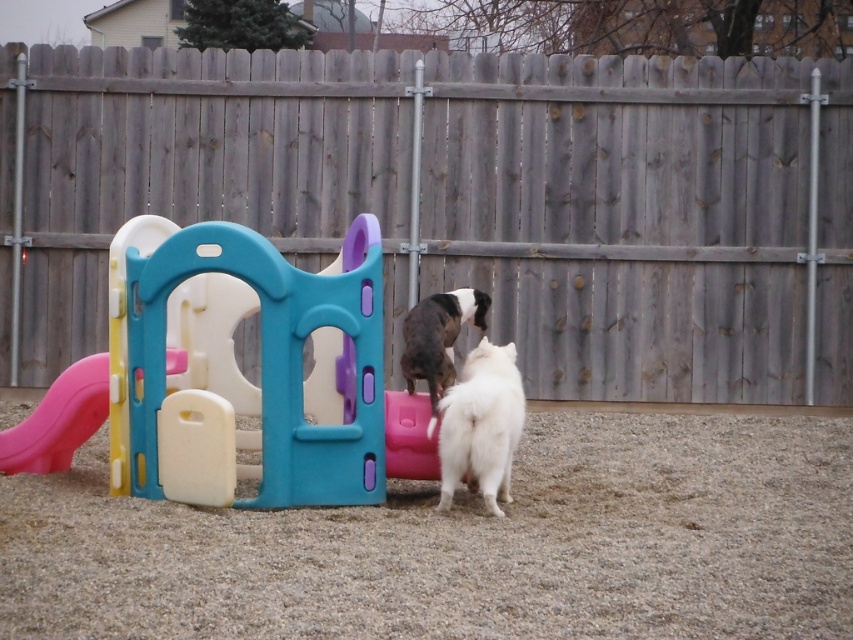
Which is in front, point (126, 170) or point (498, 428)?

Point (498, 428) is more forward.

Locate an element on the screen. This screenshot has height=640, width=853. wooden fence at center is located at coordinates (625, 218).

The width and height of the screenshot is (853, 640). What are the coordinates of `wooden fence at center` in the screenshot? It's located at (625, 218).

Between point (68, 163) and point (206, 248), which one is positioned behind?

The point (68, 163) is behind.

Is wooden fence at center thinner than plastic playhouse at center?

Incorrect, wooden fence at center's width is not less than plastic playhouse at center's.

What do you see at coordinates (625, 218) in the screenshot?
I see `wooden fence at center` at bounding box center [625, 218].

At what (x,y) coordinates should I click in order to perform the action: click on wooden fence at center. Please return your answer as a coordinate pair (x, y). Looking at the image, I should click on (625, 218).

This screenshot has width=853, height=640. What do you see at coordinates (236, 368) in the screenshot? I see `plastic playhouse at center` at bounding box center [236, 368].

Which is behind, point (132, 342) or point (12, 438)?

The point (12, 438) is more distant.

Find the location of `plastic playhouse at center`. plastic playhouse at center is located at coordinates (236, 368).